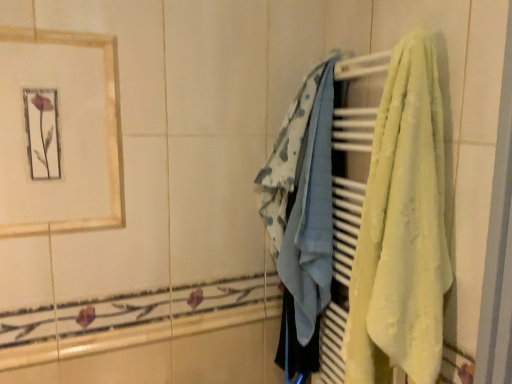
Question: Does gold-framed picture at upper left have a greater height compared to yellow soft towel at right, which appears as the first towel when viewed from the front?

Choices:
 (A) no
 (B) yes

Answer: (A)

Question: Is gold-framed picture at upper left not close to yellow soft towel at right, placed as the second towel when sorted from back to front?

Choices:
 (A) yes
 (B) no

Answer: (B)

Question: From the image's perspective, is gold-framed picture at upper left located beneath yellow soft towel at right, placed as the second towel when sorted from back to front?

Choices:
 (A) no
 (B) yes

Answer: (A)

Question: From a real-world perspective, is gold-framed picture at upper left over yellow soft towel at right, placed as the second towel when sorted from back to front?

Choices:
 (A) no
 (B) yes

Answer: (B)

Question: Can yellow soft towel at right, which appears as the first towel when viewed from the front, be found inside gold-framed picture at upper left?

Choices:
 (A) yes
 (B) no

Answer: (B)

Question: In the image, is gold-framed picture at upper left positioned in front of or behind yellow soft towel at right, the 1th towel in the right-to-left sequence?

Choices:
 (A) front
 (B) behind

Answer: (B)

Question: Considering the positions of gold-framed picture at upper left and yellow soft towel at right, which appears as the first towel when viewed from the front, in the image, is gold-framed picture at upper left taller or shorter than yellow soft towel at right, which appears as the first towel when viewed from the front,?

Choices:
 (A) short
 (B) tall

Answer: (A)

Question: Considering the positions of gold-framed picture at upper left and yellow soft towel at right, which appears as the first towel when viewed from the front, in the image, is gold-framed picture at upper left bigger or smaller than yellow soft towel at right, which appears as the first towel when viewed from the front,?

Choices:
 (A) big
 (B) small

Answer: (B)

Question: From the image's perspective, is gold-framed picture at upper left located above or below yellow soft towel at right, placed as the second towel when sorted from back to front?

Choices:
 (A) below
 (B) above

Answer: (B)

Question: Is yellow soft towel at right, placed as the second towel when sorted from back to front, taller or shorter than gold-framed picture at upper left?

Choices:
 (A) short
 (B) tall

Answer: (B)

Question: Would you say yellow soft towel at right, which is counted as the second towel, starting from the left, is to the left or to the right of gold-framed picture at upper left in the picture?

Choices:
 (A) left
 (B) right

Answer: (B)

Question: In the image, is yellow soft towel at right, which is counted as the second towel, starting from the left, positioned in front of or behind gold-framed picture at upper left?

Choices:
 (A) behind
 (B) front

Answer: (B)

Question: Is yellow soft towel at right, the 1th towel in the right-to-left sequence, situated inside gold-framed picture at upper left or outside?

Choices:
 (A) outside
 (B) inside

Answer: (A)

Question: Is point (95, 145) positioned closer to the camera than point (293, 284)?

Choices:
 (A) farther
 (B) closer

Answer: (B)

Question: Looking at the image, does gold-framed picture at upper left seem bigger or smaller compared to light blue fabric at center, the second towel in the front-to-back sequence?

Choices:
 (A) small
 (B) big

Answer: (A)